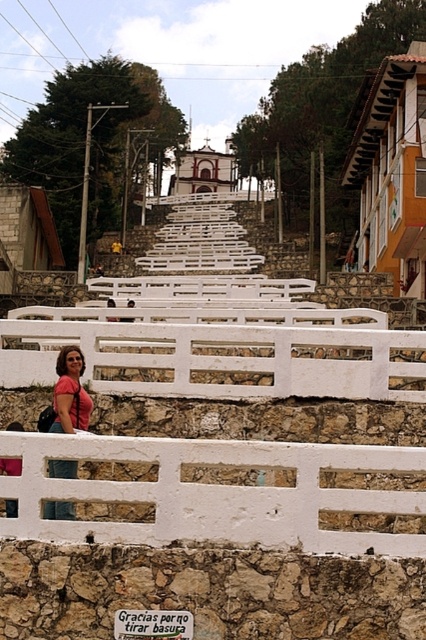
You are standing at the bottom of the staircase and see both the white stone fence at lower center and the white painted wood fence at lower center. Which one is positioned to the right side from your viewpoint?

The white stone fence at lower center is positioned to the right of the white painted wood fence at lower center, so the white stone fence at lower center is on the right side from your viewpoint.

You are standing at the bottom of the staircase leading to the church and see both the white stone fence at lower center and the pink fabric bag at lower left. Which object is closer to you?

The white stone fence at lower center is closer to you because it is in front of the pink fabric bag at lower left.

You are a photographer setting up a shot of the white painted wood fence at lower center and the pink fabric bag at lower left. Which object should you move closer to the camera to make them appear the same size in the photo?

The pink fabric bag at lower left should be moved closer to the camera because it is currently positioned to the left of the white painted wood fence at lower center, so moving it forward would balance their sizes in the frame.